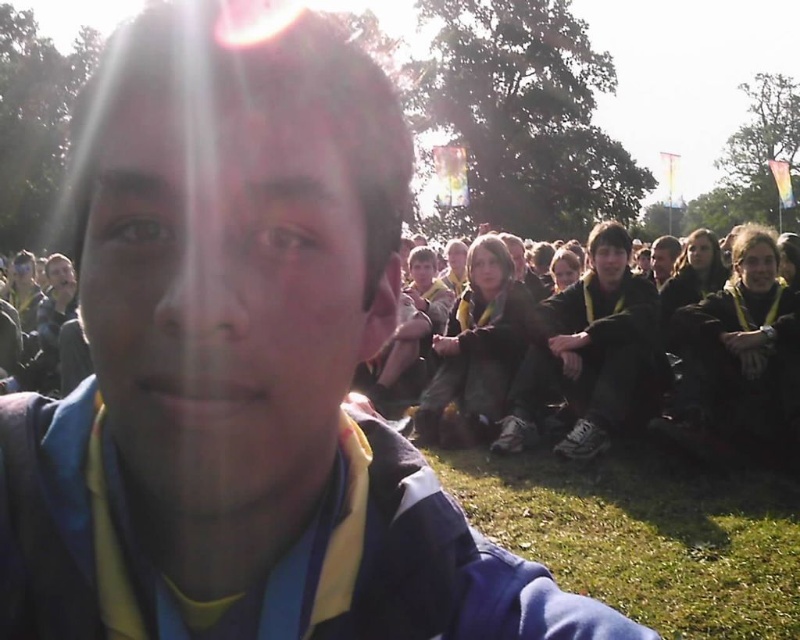
Question: Which of the following is the farthest from the observer?

Choices:
 (A) (582, 570)
 (B) (602, 273)

Answer: (B)

Question: Is green grass at lower right positioned in front of dark brown leather jacket at center?

Choices:
 (A) no
 (B) yes

Answer: (B)

Question: Which of the following is the closest to the observer?

Choices:
 (A) (676, 520)
 (B) (504, 435)

Answer: (A)

Question: Observing the image, what is the correct spatial positioning of green grass at lower right in reference to dark brown leather jacket at center?

Choices:
 (A) below
 (B) above

Answer: (A)

Question: Is green grass at lower right in front of dark brown leather jacket at center?

Choices:
 (A) no
 (B) yes

Answer: (B)

Question: Which object appears farthest from the camera in this image?

Choices:
 (A) green grass at lower right
 (B) dark brown leather jacket at center

Answer: (B)